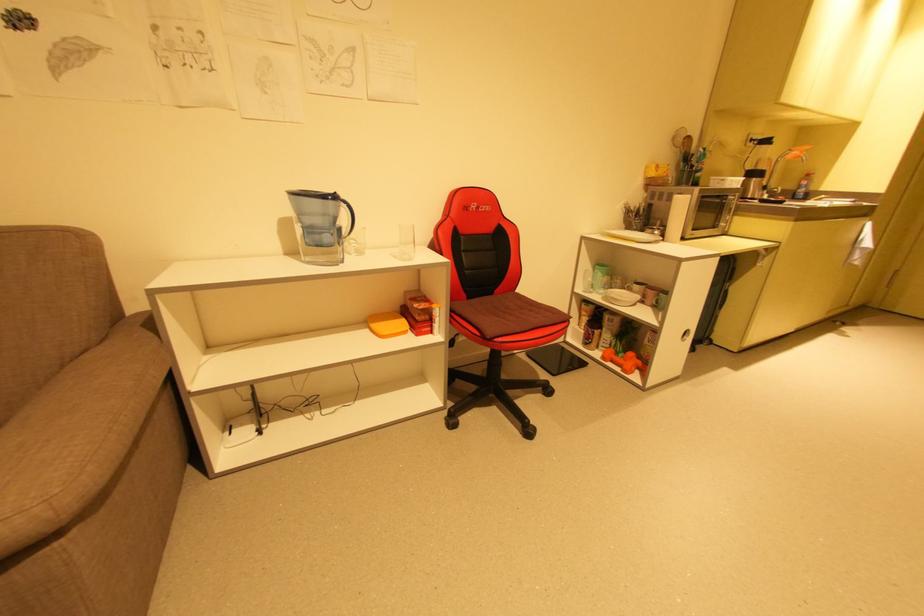
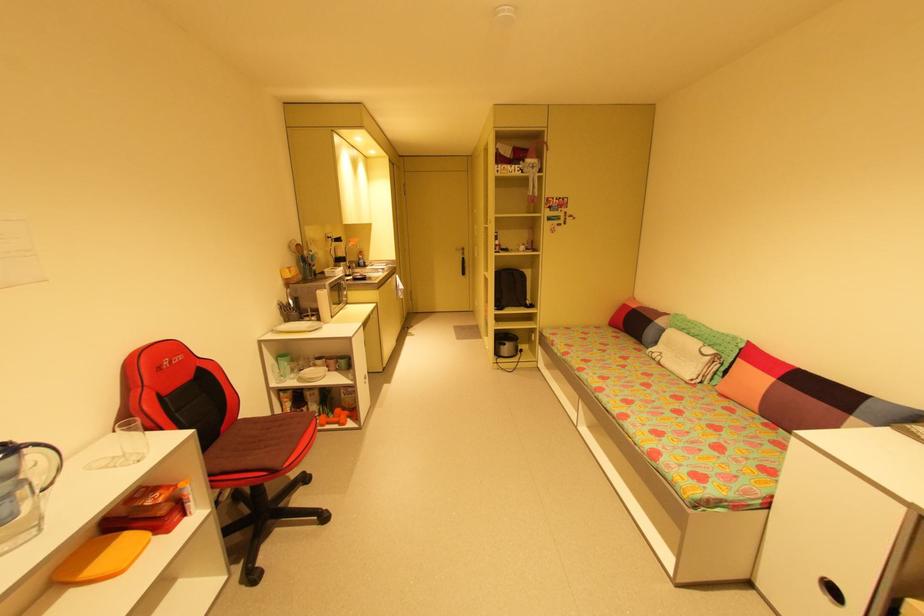
The point at (627, 288) is marked in the first image. Where is the corresponding point in the second image?

(313, 367)